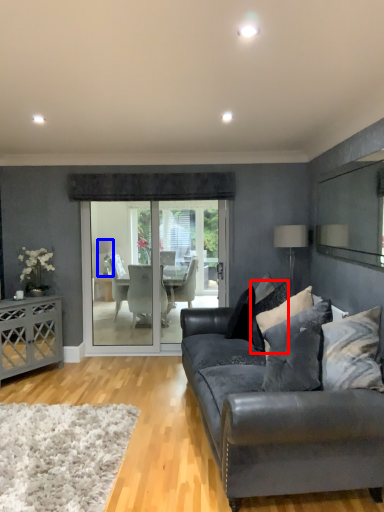
Question: Which point is further to the camera, pillow (highlighted by a red box) or lamp (highlighted by a blue box)?

Choices:
 (A) pillow
 (B) lamp

Answer: (B)